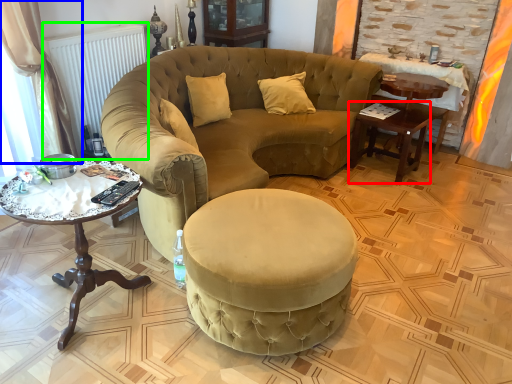
Question: Which object is the closest to the table (highlighted by a red box)? Choose among these: curtain (highlighted by a blue box) or radiator (highlighted by a green box).

Choices:
 (A) curtain
 (B) radiator

Answer: (B)